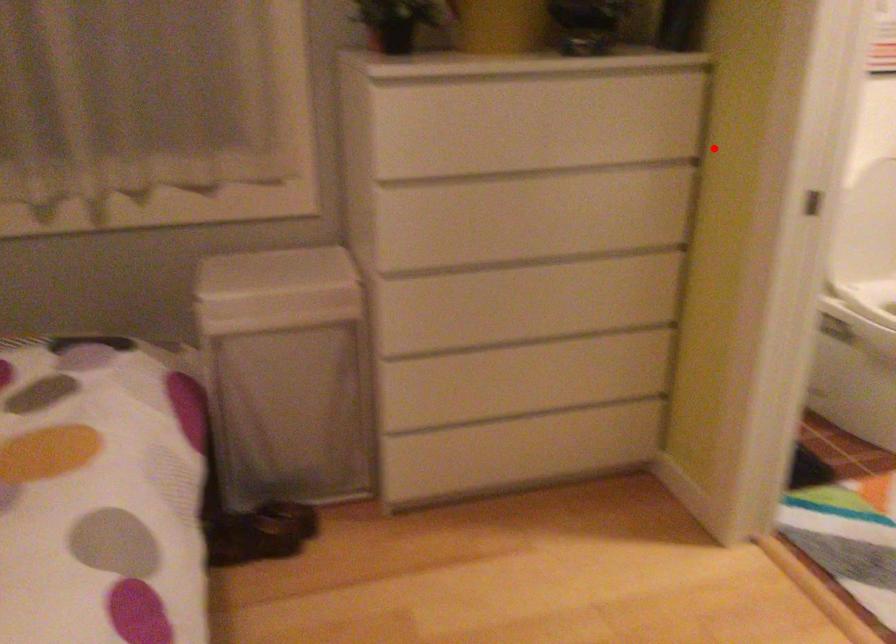
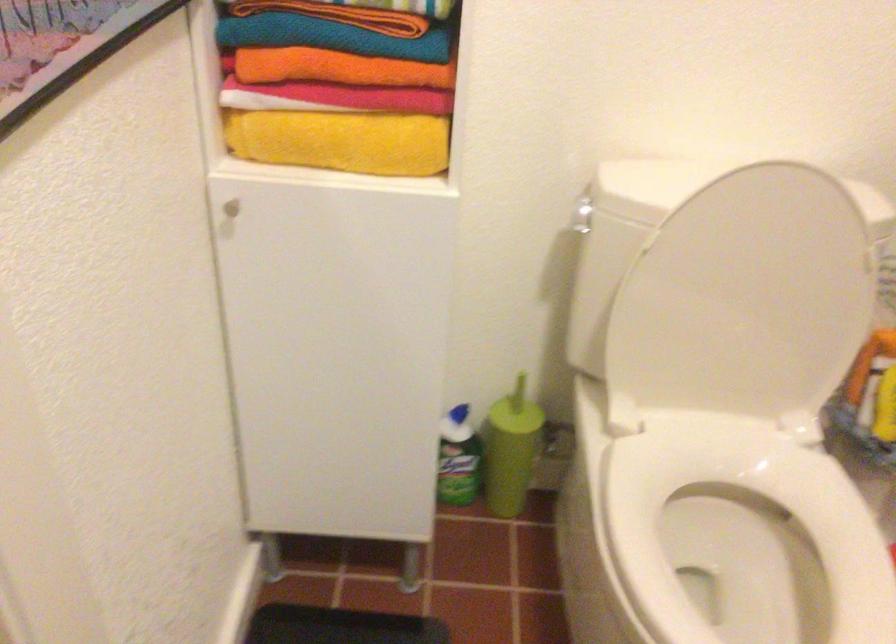
Where in the second image is the point corresponding to the highlighted location from the first image?

(339, 68)